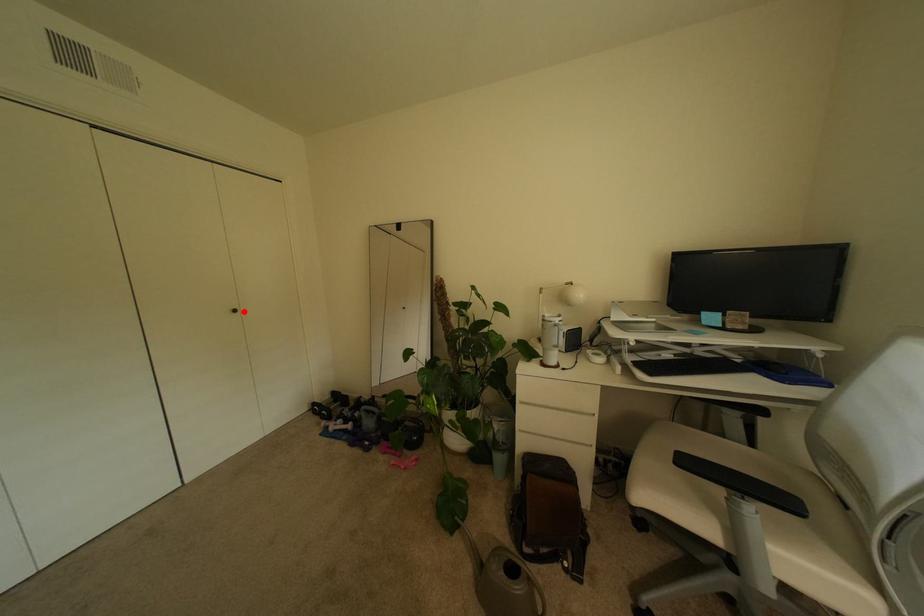
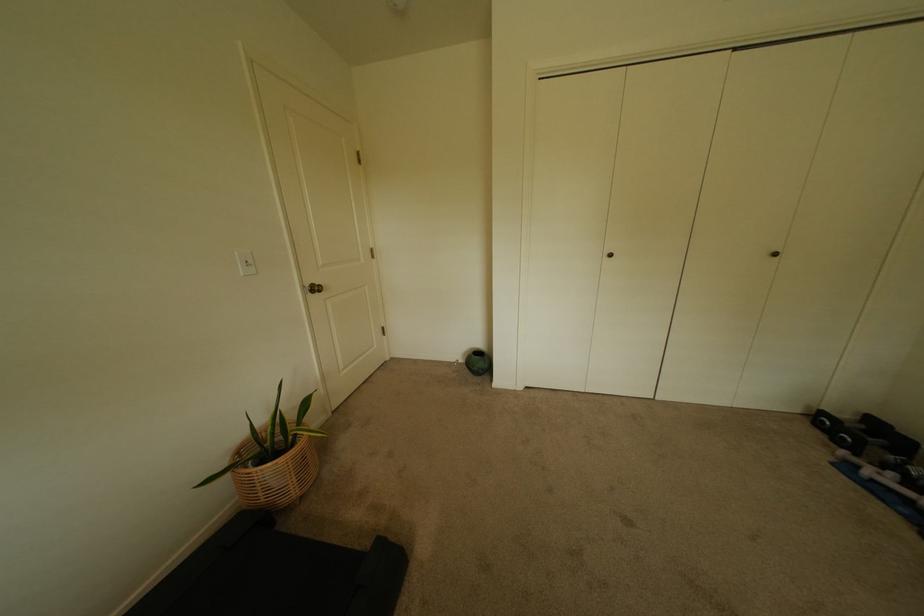
The point at the highlighted location is marked in the first image. Where is the corresponding point in the second image?

(784, 256)